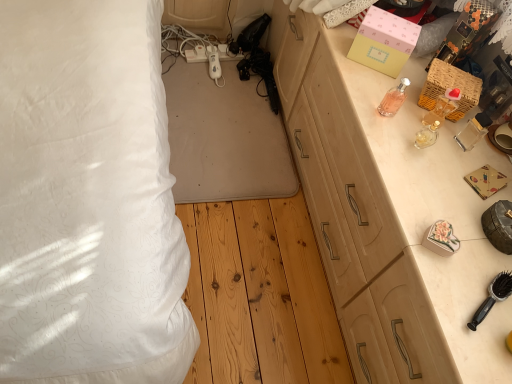
Question: Does pink matte box at upper right, arranged as the 2th box when viewed from the right, have a lesser width compared to pink glass bottle at upper right, the first perfume in the left-to-right sequence?

Choices:
 (A) yes
 (B) no

Answer: (B)

Question: Is pink matte box at upper right, placed as the first box when sorted from left to right, far from pink glass bottle at upper right, positioned as the 3th perfume in right-to-left order?

Choices:
 (A) no
 (B) yes

Answer: (A)

Question: From a real-world perspective, is pink matte box at upper right, placed as the first box when sorted from left to right, under pink glass bottle at upper right, the first perfume in the left-to-right sequence?

Choices:
 (A) no
 (B) yes

Answer: (A)

Question: From a real-world perspective, is pink matte box at upper right, placed as the first box when sorted from left to right, on pink glass bottle at upper right, positioned as the 3th perfume in right-to-left order?

Choices:
 (A) yes
 (B) no

Answer: (A)

Question: Is pink matte box at upper right, arranged as the 2th box when viewed from the right, at the right side of pink glass bottle at upper right, positioned as the 3th perfume in right-to-left order?

Choices:
 (A) no
 (B) yes

Answer: (B)

Question: Can you confirm if pink matte box at upper right, arranged as the 2th box when viewed from the right, is shorter than pink glass bottle at upper right, positioned as the 3th perfume in right-to-left order?

Choices:
 (A) yes
 (B) no

Answer: (B)

Question: Does pink matte box at upper right, placed as the first box when sorted from left to right, have a lesser width compared to translucent glass perfume at right, the 2th perfume viewed from the right?

Choices:
 (A) yes
 (B) no

Answer: (B)

Question: Is pink matte box at upper right, placed as the first box when sorted from left to right, taller than translucent glass perfume at right, the second perfume from the left?

Choices:
 (A) no
 (B) yes

Answer: (B)

Question: From a real-world perspective, is pink matte box at upper right, arranged as the 2th box when viewed from the right, on top of translucent glass perfume at right, the second perfume from the left?

Choices:
 (A) yes
 (B) no

Answer: (A)

Question: From a real-world perspective, is pink matte box at upper right, placed as the first box when sorted from left to right, under translucent glass perfume at right, the 2th perfume viewed from the right?

Choices:
 (A) yes
 (B) no

Answer: (B)

Question: Is pink matte box at upper right, arranged as the 2th box when viewed from the right, facing away from translucent glass perfume at right, the second perfume from the left?

Choices:
 (A) no
 (B) yes

Answer: (A)

Question: Is pink matte box at upper right, arranged as the 2th box when viewed from the right, further to camera compared to translucent glass perfume at right, the 2th perfume viewed from the right?

Choices:
 (A) yes
 (B) no

Answer: (A)

Question: Can you confirm if pink glass bottle at upper right, the first perfume in the left-to-right sequence, is bigger than black plastic brush at lower right?

Choices:
 (A) yes
 (B) no

Answer: (B)